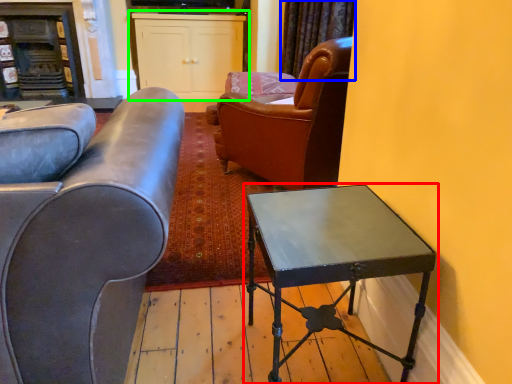
Question: Which object is positioned farthest from table (highlighted by a red box)? Select from curtain (highlighted by a blue box) and cabinetry (highlighted by a green box).

Choices:
 (A) curtain
 (B) cabinetry

Answer: (B)